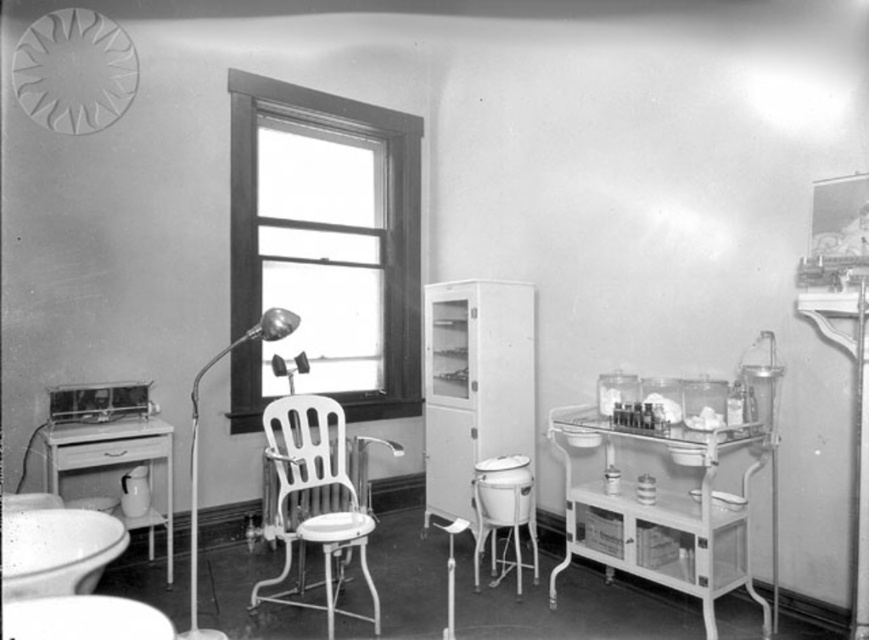
Between wooden frame window at center and white porcelain sink at lower left, which one is positioned lower?

Positioned lower is white porcelain sink at lower left.

Does wooden frame window at center lie behind white porcelain sink at lower left?

Yes.

Find the location of a particular element. The image size is (869, 640). wooden frame window at center is located at coordinates (324, 244).

Who is more distant from viewer, (708, 474) or (65, 449)?

The point (65, 449) is more distant.

Can you confirm if metallic white cart at right is smaller than white glossy table at left?

Actually, metallic white cart at right might be larger than white glossy table at left.

The height and width of the screenshot is (640, 869). I want to click on metallic white cart at right, so click(x=665, y=509).

At what (x,y) coordinates should I click in order to perform the action: click on metallic white cart at right. Please return your answer as a coordinate pair (x, y). This screenshot has height=640, width=869. Looking at the image, I should click on (665, 509).

Is metallic white cart at right to the left of white plastic chair at center from the viewer's perspective?

No, metallic white cart at right is not to the left of white plastic chair at center.

Who is lower down, metallic white cart at right or white plastic chair at center?

Positioned lower is white plastic chair at center.

Locate an element on the screen. metallic white cart at right is located at coordinates (x=665, y=509).